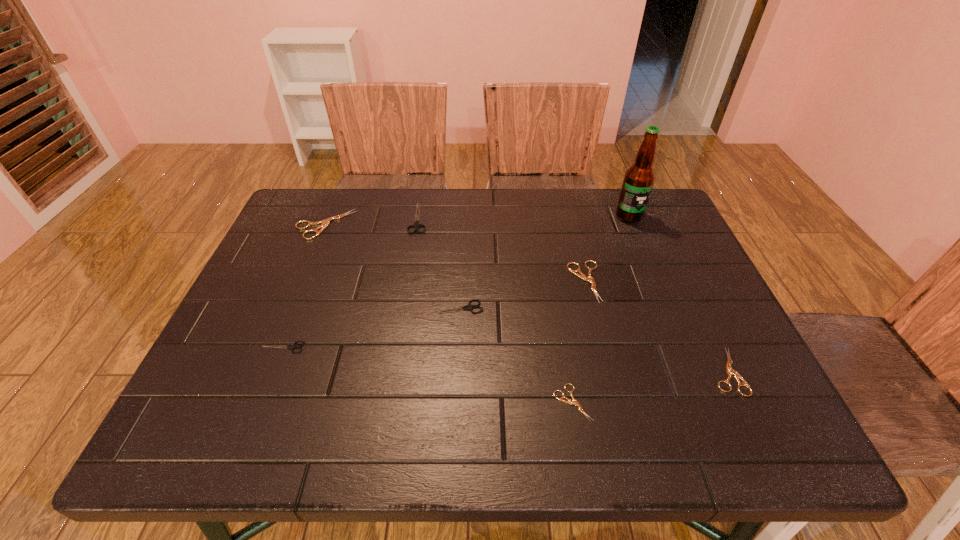
At what (x,y) coordinates should I click in order to perform the action: click on vacant area between the third beige shears from right to left and the third biggest beige shears. Please return your answer as a coordinate pair (x, y). Looking at the image, I should click on (649, 387).

Find the location of a particular element. Image resolution: width=960 pixels, height=540 pixels. free spot between the fifth shears from left to right and the brown beer bottle is located at coordinates (600, 309).

You are a GUI agent. You are given a task and a screenshot of the screen. Output one action in this format:
    pyautogui.click(x=<x>, y=<y>)
    Task: Click on the free spot between the beer bottle and the biggest black shears
    
    Given the screenshot: What is the action you would take?
    pyautogui.click(x=523, y=217)

Identify the location of free space between the fifth shears from right to left and the biggest beige shears. This screenshot has width=960, height=540. (372, 221).

Identify the location of unoccupied area between the third shears from right to left and the rightmost black shears. (515, 355).

The width and height of the screenshot is (960, 540). I want to click on vacant area between the rightmost beige shears and the fourth object from right to left, so click(649, 387).

Where is `blank region between the farthest black shears and the smallest black shears`? This screenshot has height=540, width=960. blank region between the farthest black shears and the smallest black shears is located at coordinates (350, 283).

Identify the location of object that stands as the seventh closest to the rightmost beige shears. The height and width of the screenshot is (540, 960). (324, 223).

Find the location of `object that is the fifth closest to the rightmost shears`. object that is the fifth closest to the rightmost shears is located at coordinates (416, 225).

Locate an element on the screen. Image resolution: width=960 pixels, height=540 pixels. shears that is the third closest one to the leftmost black shears is located at coordinates (416, 225).